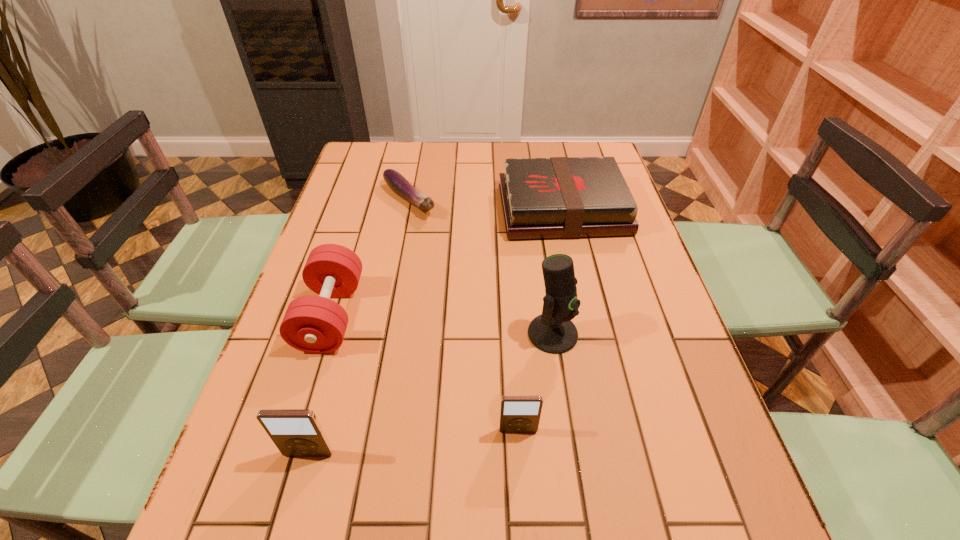
All iPods are currently evenly spaced. To continue this pattern, where would you add another iPod on the right? Please point out a vacant spot. Please provide its 2D coordinates. Your answer should be formatted as a tuple, i.e. [(x, y)], where the tuple contains the x and y coordinates of a point satisfying the conditions above.

[(712, 410)]